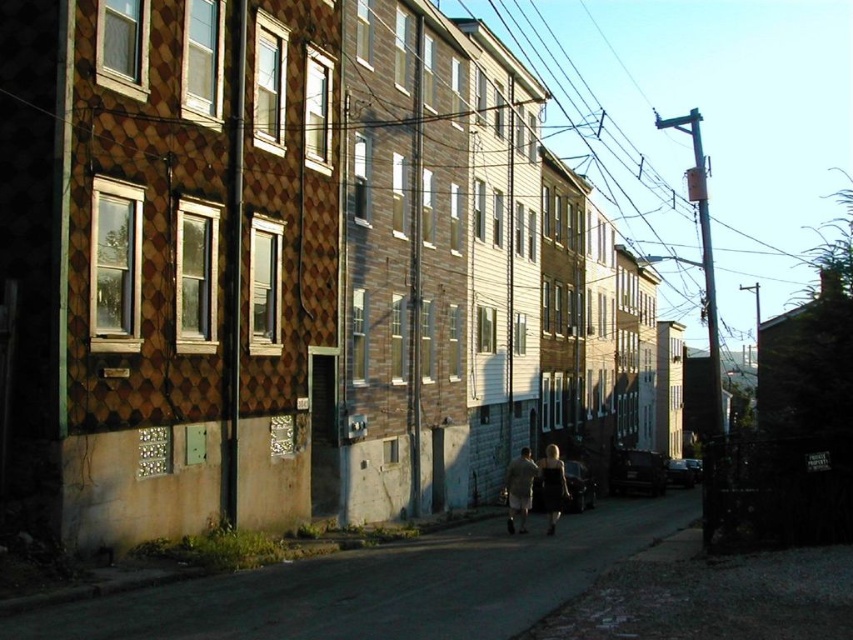
You are standing on the sidewalk and see the smooth concrete alley at center and the light brown fabric pants at center. Which object is positioned to the left?

The smooth concrete alley at center is to the left of the light brown fabric pants at center.

You are standing on the sidewalk looking at the smooth concrete alley at center and the matte black dress at center. Which object is nearer to you?

The smooth concrete alley at center is closer to the viewer than the matte black dress at center, so the smooth concrete alley at center is nearer to you.

You are standing on the street and want to walk towards both the point at coordinates (576, 529) and the point at coordinates (558, 506). Which point will you reach first?

You will reach the point at coordinates (576, 529) first because it is closer to you than the point at coordinates (558, 506).